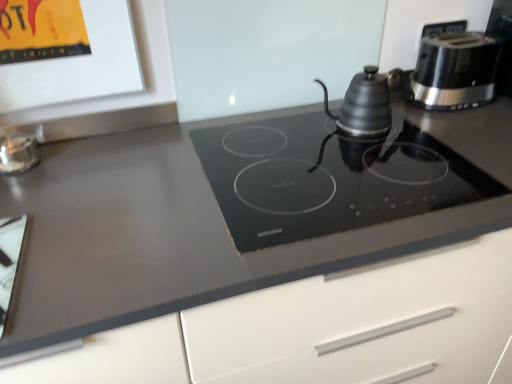
Question: Would you say white glossy cutting board at lower left, marked as the second appliance in a back-to-front arrangement, is inside or outside black plastic toaster at upper right, arranged as the second kitchen appliance when viewed from the left?

Choices:
 (A) outside
 (B) inside

Answer: (A)

Question: In terms of height, does white glossy cutting board at lower left, which ranks as the second appliance in top-to-bottom order, look taller or shorter compared to black plastic toaster at upper right, arranged as the second kitchen appliance when viewed from the left?

Choices:
 (A) short
 (B) tall

Answer: (A)

Question: Based on their relative distances, which object is nearer to the clear glass jar at left, placed as the 1th appliance when sorted from top to bottom?

Choices:
 (A) white glossy cutting board at lower left, marked as the second appliance in a back-to-front arrangement
 (B) black glass cooktop at center
 (C) matte black kettle at upper right, the 2th kitchen appliance positioned from the right
 (D) black plastic toaster at upper right, acting as the first kitchen appliance starting from the right

Answer: (A)

Question: Which of these objects is positioned farthest from the matte black kettle at upper right, the first kitchen appliance viewed from the left?

Choices:
 (A) black plastic toaster at upper right, arranged as the second kitchen appliance when viewed from the left
 (B) white glossy cutting board at lower left, which is counted as the 1th appliance, starting from the front
 (C) black glass cooktop at center
 (D) clear glass jar at left, which is the second appliance in front-to-back order

Answer: (B)